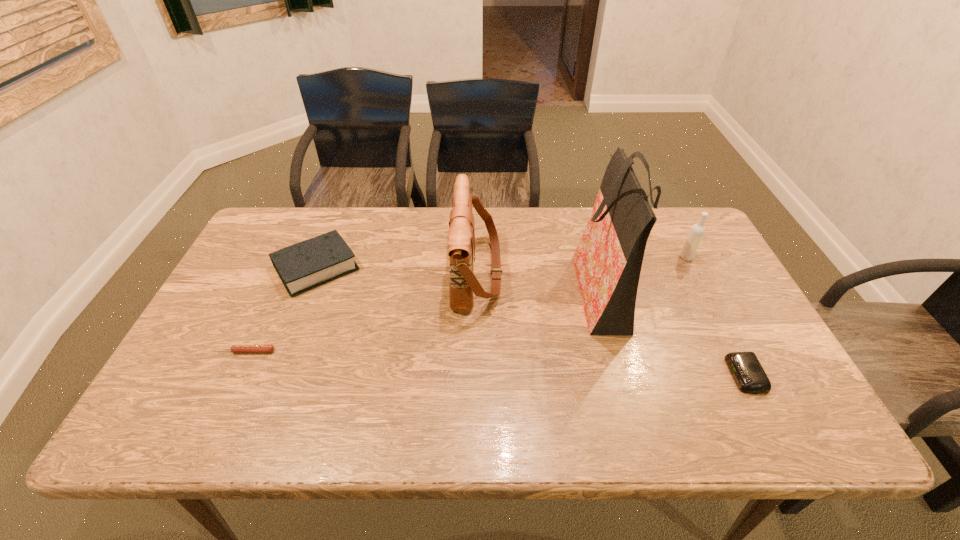
I want to click on vacant space that is in between the shopping bag and the fourth shortest object, so click(644, 273).

In order to click on vacant region between the shoulder bag and the fourth tallest object in this screenshot , I will do click(x=397, y=270).

Locate an element on the screen. The height and width of the screenshot is (540, 960). free area in between the fourth shortest object and the Bible is located at coordinates click(502, 263).

Where is `free space between the tallest object and the second shortest object`? The width and height of the screenshot is (960, 540). free space between the tallest object and the second shortest object is located at coordinates (673, 332).

Find the location of a particular element. free spot between the vodka and the second shortest object is located at coordinates pyautogui.click(x=715, y=316).

Image resolution: width=960 pixels, height=540 pixels. I want to click on the closest object relative to the Bible, so click(234, 348).

You are a GUI agent. You are given a task and a screenshot of the screen. Output one action in this format:
    pyautogui.click(x=<x>, y=<y>)
    Task: Click on the object that stands as the fourth closest to the third object from right to left
    The image size is (960, 540).
    Given the screenshot: What is the action you would take?
    pyautogui.click(x=310, y=263)